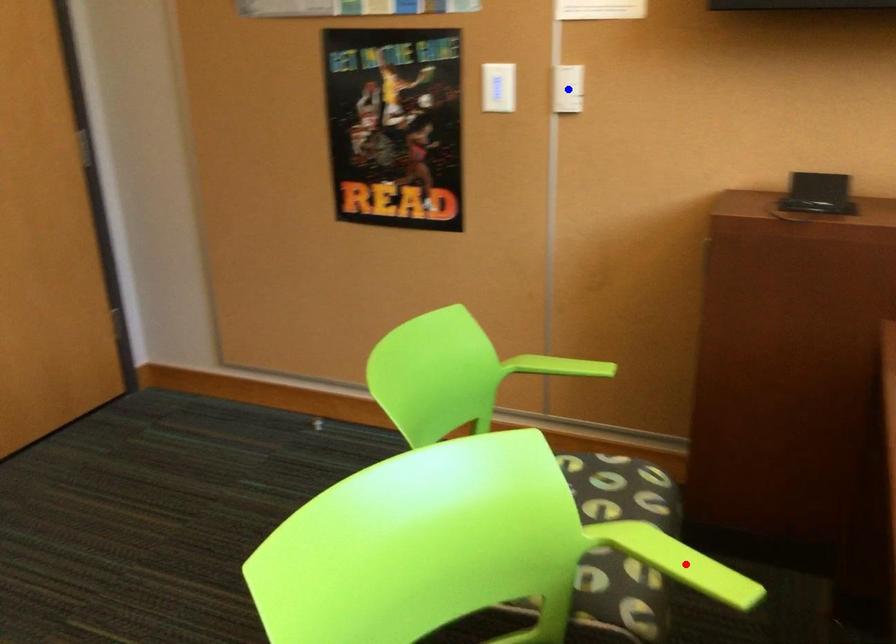
Question: Which of the two points in the image is closer to the camera?

Choices:
 (A) Blue point is closer.
 (B) Red point is closer.

Answer: (B)